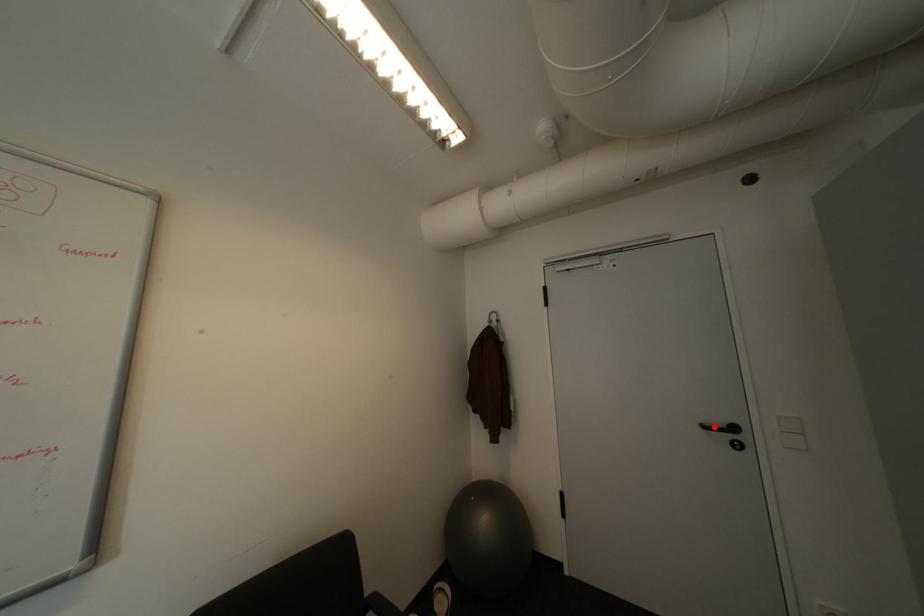
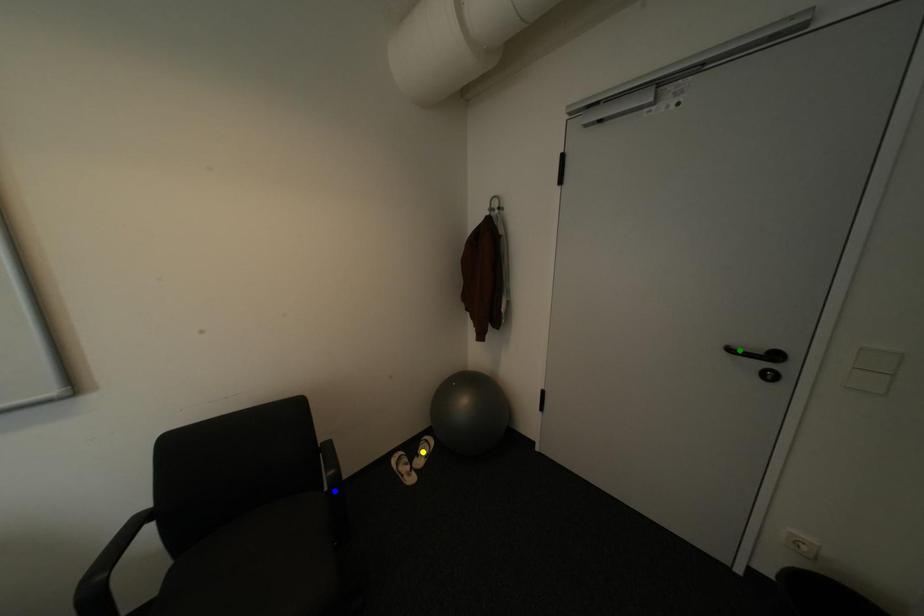
Question: I am providing you with two images of the same scene from different viewpoints. A red point is marked on the first image. You are given multiple points on the second image. In image 2, which mark is for the same physical point as the one in image 1?

Choices:
 (A) blue point
 (B) yellow point
 (C) green point

Answer: (C)